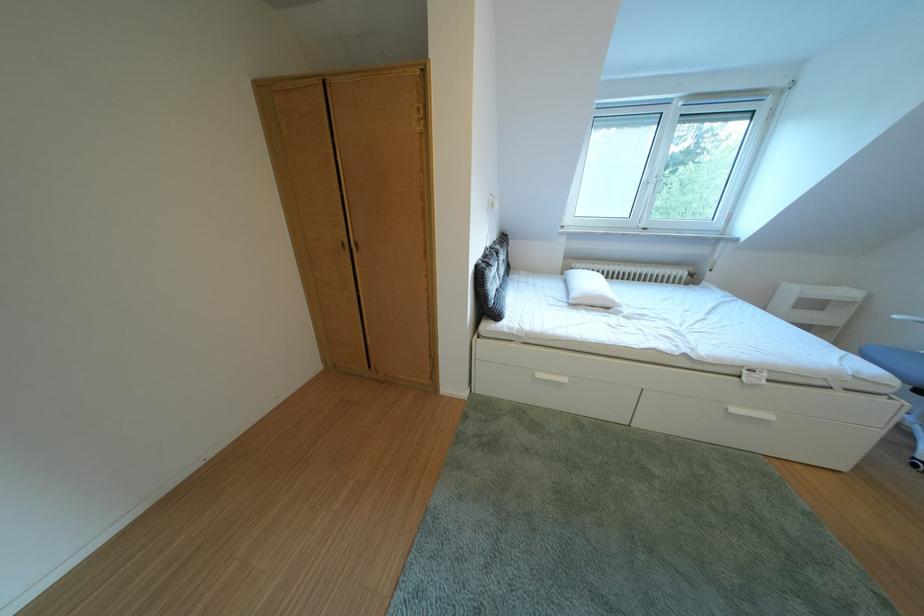
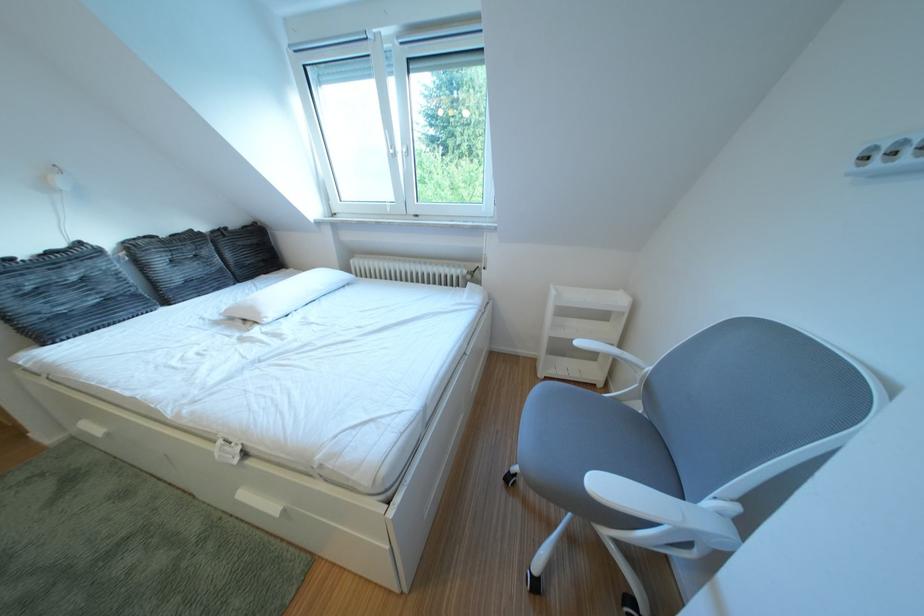
In the second image, find the point that corresponds to point 626,306 in the first image.

(273, 318)